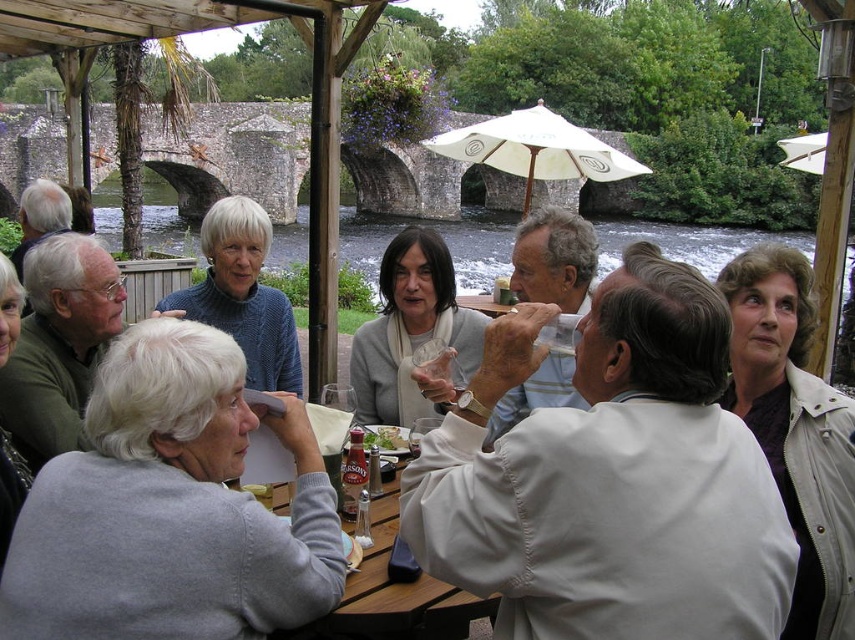
Which is in front, point (545, 252) or point (374, 432)?

Positioned in front is point (374, 432).

Which is behind, point (573, 237) or point (366, 436)?

Point (573, 237)

Locate an element on the screen. light gray sweater at center is located at coordinates (553, 259).

Is gray cotton sweater at upper left closer to the viewer compared to white fabric umbrella at center?

Yes, gray cotton sweater at upper left is closer to the viewer.

Is gray cotton sweater at upper left wider than white fabric umbrella at center?

In fact, gray cotton sweater at upper left might be narrower than white fabric umbrella at center.

Where is `gray cotton sweater at upper left`? gray cotton sweater at upper left is located at coordinates (171, 508).

Which is above, light beige jacket at upper right or wooden table at center?

light beige jacket at upper right is higher up.

Between point (741, 257) and point (410, 628), which one is positioned behind?

Positioned behind is point (741, 257).

What do you see at coordinates (795, 429) in the screenshot? I see `light beige jacket at upper right` at bounding box center [795, 429].

Locate an element on the screen. The image size is (855, 640). light beige jacket at upper right is located at coordinates (795, 429).